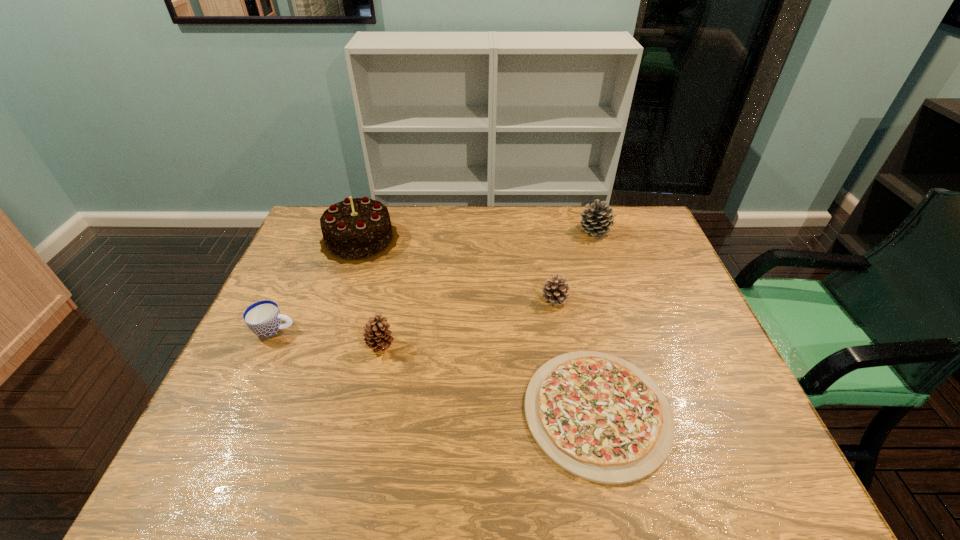
At what (x,y) coordinates should I click in order to perform the action: click on free space that satisfies the following two spatial constraints: 1. on the back side of the pizza; 2. on the side of the cup with the handle. Please return your answer as a coordinate pair (x, y). The width and height of the screenshot is (960, 540). Looking at the image, I should click on (579, 330).

This screenshot has width=960, height=540. I want to click on free space that satisfies the following two spatial constraints: 1. on the back side of the pizza; 2. on the right side of the rightmost pinecone, so click(558, 231).

This screenshot has height=540, width=960. Find the location of `vacant space that satisfies the following two spatial constraints: 1. on the back side of the pizza; 2. on the side of the cup with the handle`. vacant space that satisfies the following two spatial constraints: 1. on the back side of the pizza; 2. on the side of the cup with the handle is located at coordinates (579, 330).

The height and width of the screenshot is (540, 960). I want to click on free space that satisfies the following two spatial constraints: 1. on the side of the cup with the handle; 2. on the back side of the nearest pinecone, so click(267, 346).

You are a GUI agent. You are given a task and a screenshot of the screen. Output one action in this format:
    pyautogui.click(x=<x>, y=<y>)
    Task: Click on the free region that satisfies the following two spatial constraints: 1. on the back side of the farthest pinecone; 2. on the left side of the tallest object
    
    Given the screenshot: What is the action you would take?
    pyautogui.click(x=363, y=231)